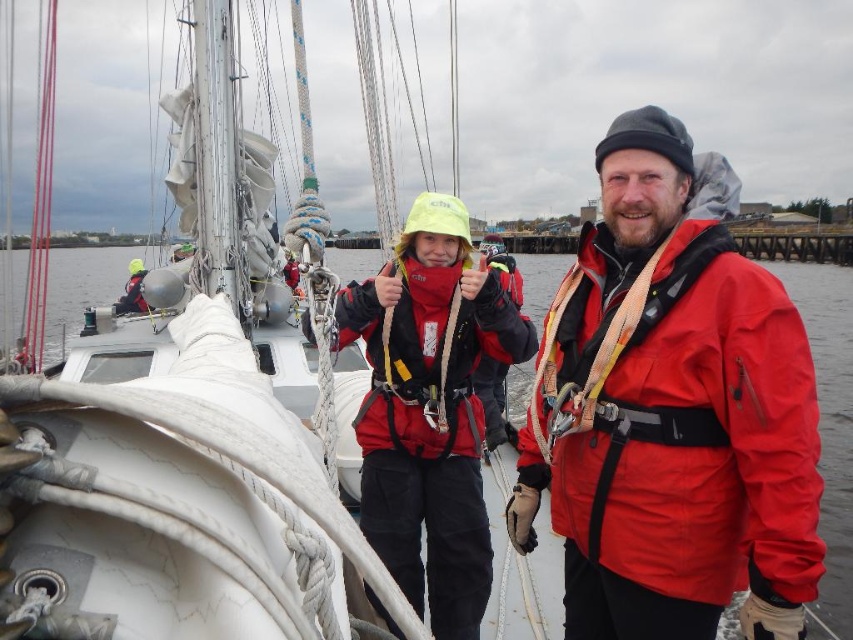
Who is more distant from viewer, (463,477) or (15,292)?

Point (15,292)

Consider the image. Between matte black jacket at center and clear water at center, which one has more height?

Standing taller between the two is clear water at center.

What are the coordinates of `matte black jacket at center` in the screenshot? It's located at (430, 408).

What are the coordinates of `matte black jacket at center` in the screenshot? It's located at (430, 408).

Between matte red jacket at center and matte red life jacket at center, which one has more height?

matte red life jacket at center

Can you confirm if matte red jacket at center is positioned to the left of matte red life jacket at center?

In fact, matte red jacket at center is to the right of matte red life jacket at center.

Between point (802, 556) and point (514, 352), which one is positioned in front?

Positioned in front is point (802, 556).

Locate an element on the screen. This screenshot has width=853, height=640. matte red jacket at center is located at coordinates tap(672, 412).

Can you confirm if white matte sailboat at upper center is taller than matte red life jacket at center?

In fact, white matte sailboat at upper center may be shorter than matte red life jacket at center.

Measure the distance between white matte sailboat at upper center and camera.

white matte sailboat at upper center is 16.21 feet away from camera.

Does point (160, 355) come farther from viewer compared to point (399, 435)?

That is True.

The image size is (853, 640). Find the location of `white matte sailboat at upper center`. white matte sailboat at upper center is located at coordinates (184, 449).